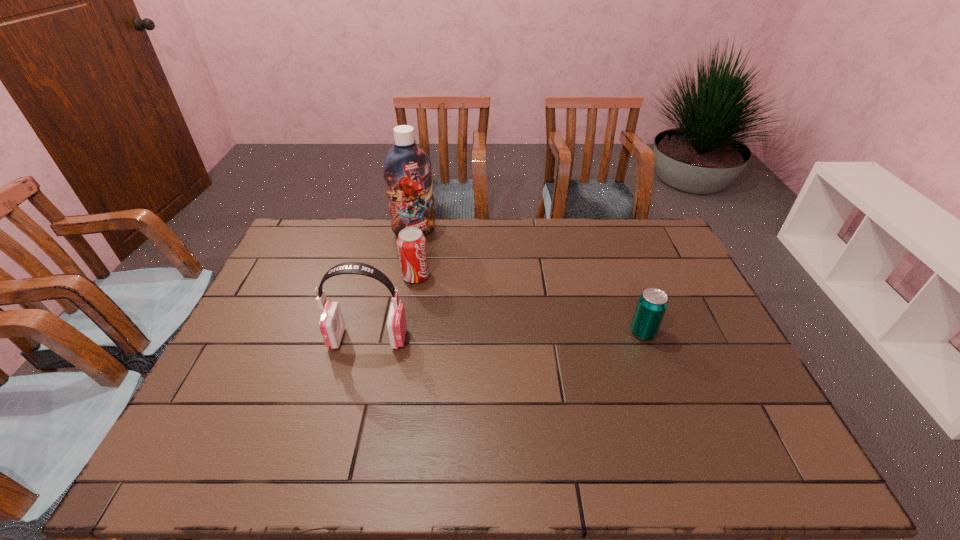
Find the location of a particular element. vacant area between the earphone and the rightmost object is located at coordinates (506, 336).

At what (x,y) coordinates should I click in order to perform the action: click on the second closest object relative to the shortest object. Please return your answer as a coordinate pair (x, y). This screenshot has width=960, height=540. Looking at the image, I should click on 331,324.

Identify the location of object identified as the closest to the earphone. Image resolution: width=960 pixels, height=540 pixels. (411, 243).

Locate an element on the screen. vacant region that satisfies the following two spatial constraints: 1. on the front side of the third nearest object; 2. on the left side of the farthest object is located at coordinates (406, 276).